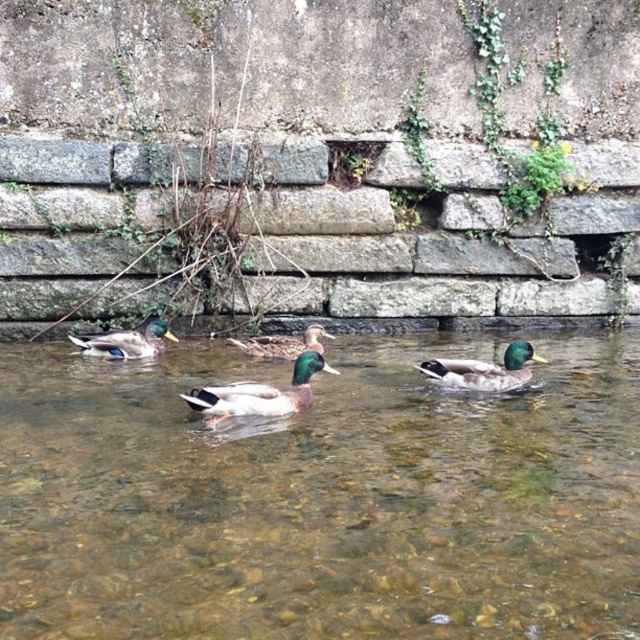
Question: Which object is the farthest from the clear water at center?

Choices:
 (A) green glossy duck at center
 (B) green glossy duck at left
 (C) green glossy duck at right

Answer: (B)

Question: Does clear water at center appear under green matte duck at center?

Choices:
 (A) no
 (B) yes

Answer: (B)

Question: Can you confirm if green matte duck at center is positioned above green glossy duck at right?

Choices:
 (A) yes
 (B) no

Answer: (B)

Question: Is green glossy duck at right positioned in front of green glossy duck at center?

Choices:
 (A) yes
 (B) no

Answer: (A)

Question: Which point is farther to the camera?

Choices:
 (A) (280, 400)
 (B) (140, 346)
 (C) (35, 493)
 (D) (512, 378)

Answer: (B)

Question: Which of the following is the closest to the observer?

Choices:
 (A) green glossy duck at left
 (B) green glossy duck at center

Answer: (A)